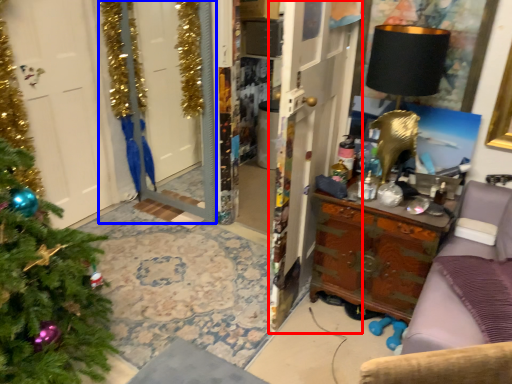
Question: Which of the following is the farthest to the observer, armoire (highlighted by a red box) or screen door (highlighted by a blue box)?

Choices:
 (A) armoire
 (B) screen door

Answer: (B)